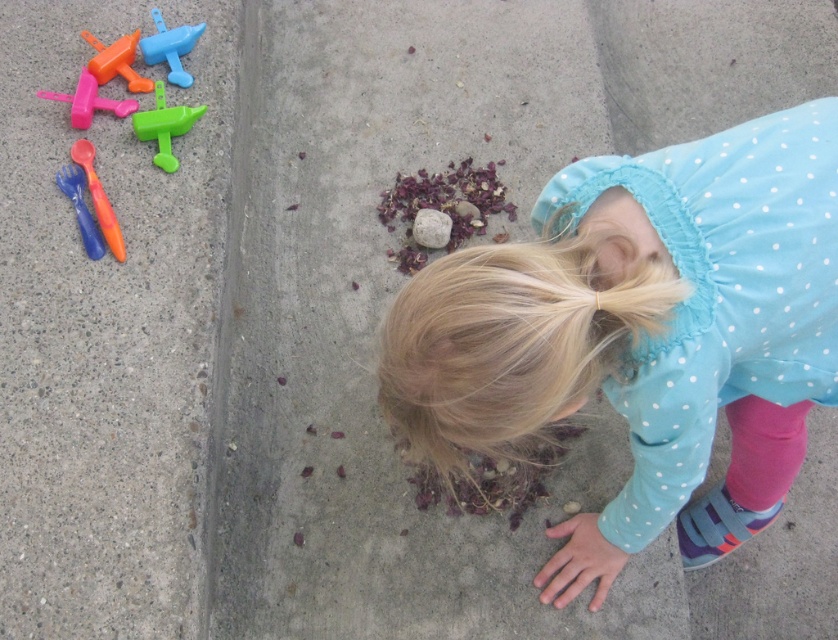
Question: Can you confirm if concrete pavement at left is positioned above translucent plastic toy airplane at upper left?

Choices:
 (A) no
 (B) yes

Answer: (A)

Question: Which object is closer to the camera taking this photo?

Choices:
 (A) matte orange airplane at upper left
 (B) blue polka dot dress at center

Answer: (B)

Question: In this image, where is matte orange airplane at upper left located relative to smooth gray rock at center?

Choices:
 (A) below
 (B) above

Answer: (B)

Question: Does matte orange airplane at upper left have a lesser width compared to smooth gray rock at center?

Choices:
 (A) yes
 (B) no

Answer: (B)

Question: Which point is farther to the camera?

Choices:
 (A) translucent plastic fork at upper left
 (B) translucent plastic toy airplane at upper left

Answer: (B)

Question: Which point is farther to the camera?

Choices:
 (A) (0, 420)
 (B) (173, 36)
 (C) (185, 129)

Answer: (B)